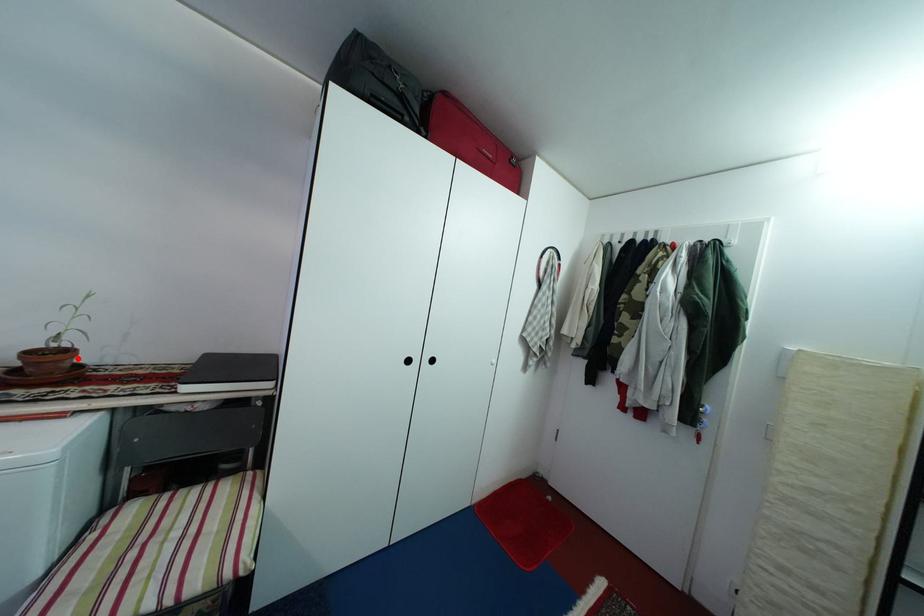
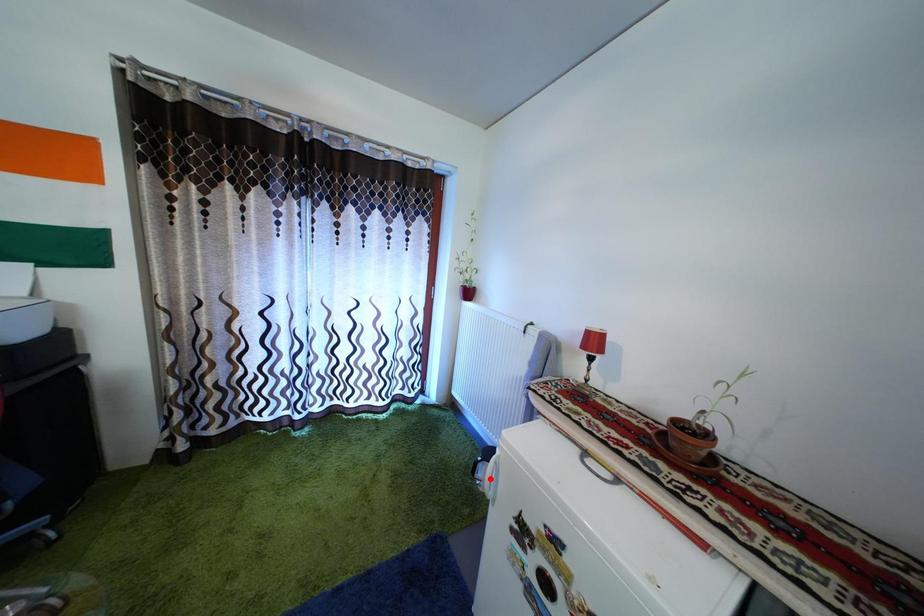
I am providing you with two images of the same scene from different viewpoints. A red point is marked on the first image and another point is marked on the second image. Is the red point in image1 aligned with the point shown in image2?

No